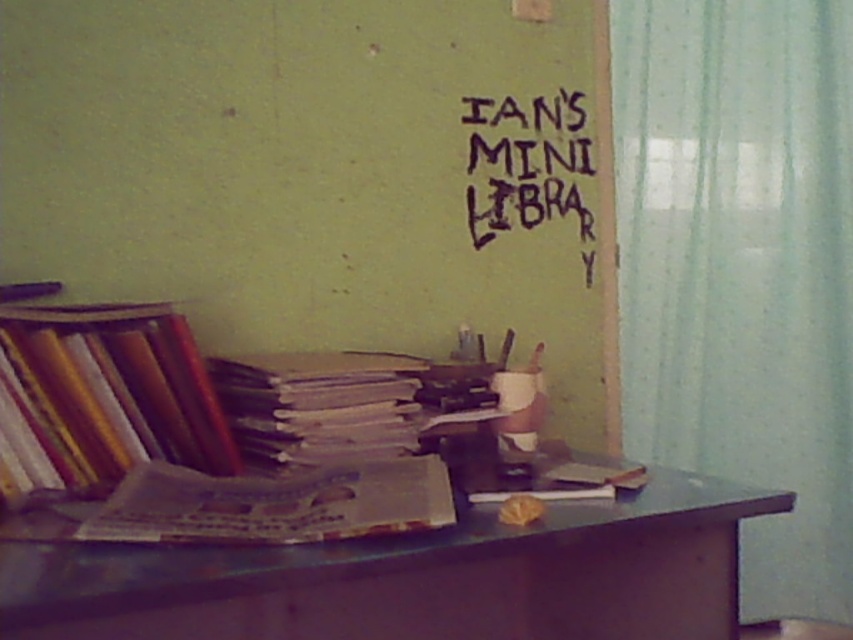
Does translucent fabric curtain at right appear under matte paper books at left?

Actually, translucent fabric curtain at right is above matte paper books at left.

Does translucent fabric curtain at right have a smaller size compared to matte paper books at left?

Actually, translucent fabric curtain at right might be larger than matte paper books at left.

Between point (776, 321) and point (97, 452), which one is positioned in front?

Point (97, 452) is in front.

Where is `translucent fabric curtain at right`? translucent fabric curtain at right is located at coordinates (741, 269).

Between smooth brown table at center and white paper stack at center, which one appears on the left side from the viewer's perspective?

Positioned to the left is white paper stack at center.

The width and height of the screenshot is (853, 640). What do you see at coordinates (415, 577) in the screenshot?
I see `smooth brown table at center` at bounding box center [415, 577].

The width and height of the screenshot is (853, 640). Describe the element at coordinates (415, 577) in the screenshot. I see `smooth brown table at center` at that location.

The height and width of the screenshot is (640, 853). Identify the location of smooth brown table at center. (415, 577).

Who is higher up, translucent fabric curtain at right or matte paper book at center?

translucent fabric curtain at right is above.

Measure the distance between point (682, 208) and camera.

The distance of point (682, 208) from camera is 6.00 feet.

The image size is (853, 640). I want to click on translucent fabric curtain at right, so click(741, 269).

Where is `translucent fabric curtain at right`? The image size is (853, 640). translucent fabric curtain at right is located at coordinates 741,269.